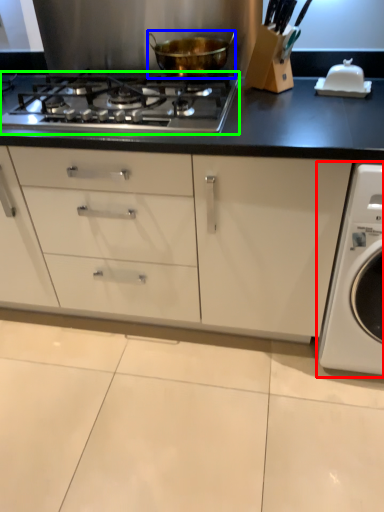
Question: Based on their relative distances, which object is nearer to washing machine (highlighted by a red box)? Choose from kitchen appliance (highlighted by a blue box) and gas stove (highlighted by a green box).

Choices:
 (A) kitchen appliance
 (B) gas stove

Answer: (B)